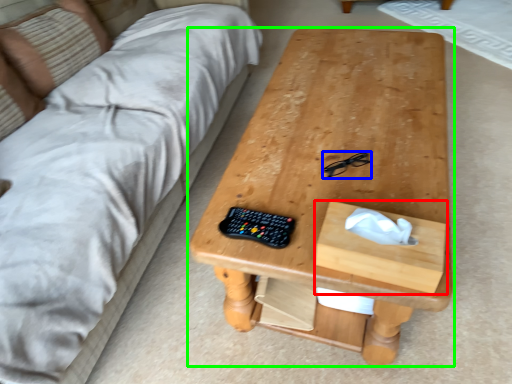
Question: Which object is positioned farthest from drawer (highlighted by a red box)? Select from glasses (highlighted by a blue box) and table (highlighted by a green box).

Choices:
 (A) glasses
 (B) table

Answer: (B)